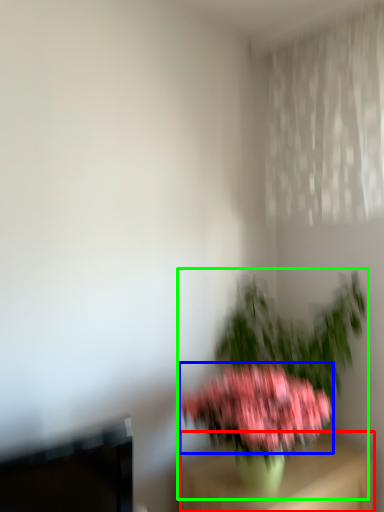
Question: Considering the real-world distances, which object is closest to furniture (highlighted by a red box)? flower (highlighted by a blue box) or houseplant (highlighted by a green box).

Choices:
 (A) flower
 (B) houseplant

Answer: (A)